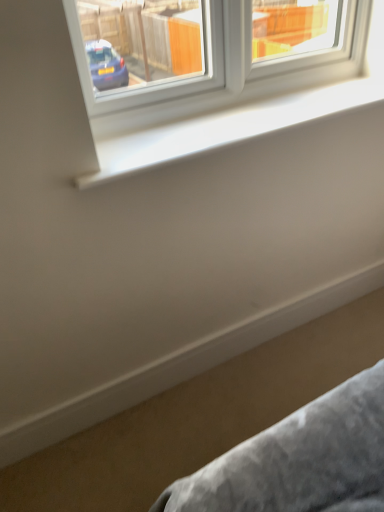
Where is `empty space that is ontop of white smooth window sill at upper center (from a real-world perspective)`? This screenshot has width=384, height=512. empty space that is ontop of white smooth window sill at upper center (from a real-world perspective) is located at coordinates (231, 119).